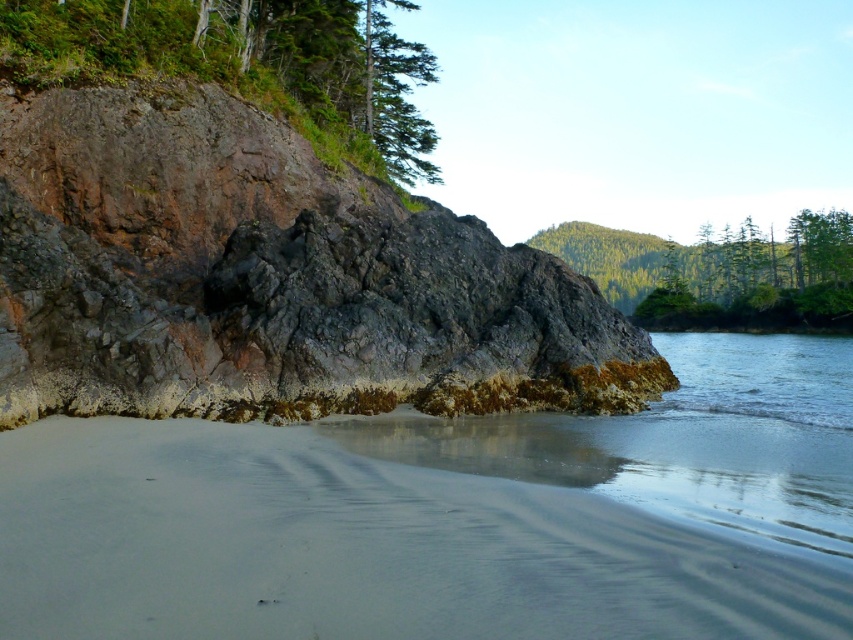
Question: Which point is closer to the camera?

Choices:
 (A) (381, 17)
 (B) (426, 168)

Answer: (A)

Question: Does rusty stone cliff at center-left lie behind green textured trees at upper right?

Choices:
 (A) no
 (B) yes

Answer: (A)

Question: Can you confirm if rusty stone cliff at center-left is smaller than brown rough rock at upper left?

Choices:
 (A) no
 (B) yes

Answer: (B)

Question: Can you confirm if green textured trees at upper right is positioned to the left of clear water at lower right?

Choices:
 (A) no
 (B) yes

Answer: (A)

Question: Considering the real-world distances, which object is closest to the clear water at lower right?

Choices:
 (A) sandy beach at lower left
 (B) brown rough rock at upper left

Answer: (A)

Question: Which of the following is the farthest from the observer?

Choices:
 (A) (819, 390)
 (B) (527, 349)

Answer: (A)